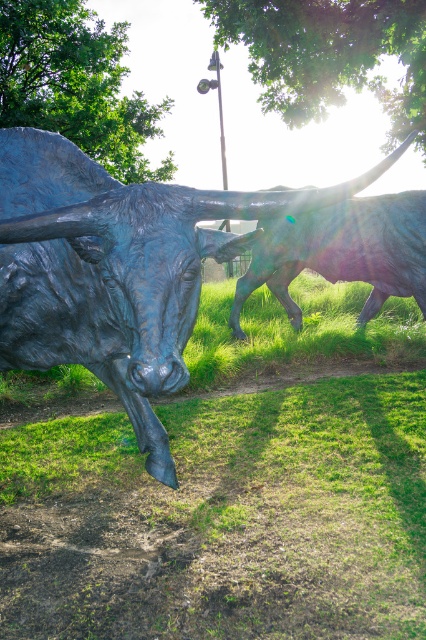
Can you confirm if green grass at center is thinner than shiny bronze bull at center?

In fact, green grass at center might be wider than shiny bronze bull at center.

Is green grass at center above shiny bronze bull at center?

No.

Find the location of a particular element. The width and height of the screenshot is (426, 640). green grass at center is located at coordinates (230, 490).

At what (x,y) coordinates should I click in order to perform the action: click on green grass at center. Please return your answer as a coordinate pair (x, y). The image size is (426, 640). Looking at the image, I should click on (230, 490).

Can you confirm if bronze textured bull at left is positioned above shiny bronze bull at center?

Actually, bronze textured bull at left is below shiny bronze bull at center.

What do you see at coordinates (117, 268) in the screenshot?
I see `bronze textured bull at left` at bounding box center [117, 268].

Find the location of a particular element. This screenshot has height=640, width=426. bronze textured bull at left is located at coordinates (117, 268).

Can you confirm if green grass at center is positioned to the left of bronze textured bull at left?

Correct, you'll find green grass at center to the left of bronze textured bull at left.

Is green grass at center shorter than bronze textured bull at left?

Indeed, green grass at center has a lesser height compared to bronze textured bull at left.

Is point (339, 394) less distant than point (6, 352)?

No, it is behind (6, 352).

The height and width of the screenshot is (640, 426). I want to click on green grass at center, so click(x=230, y=490).